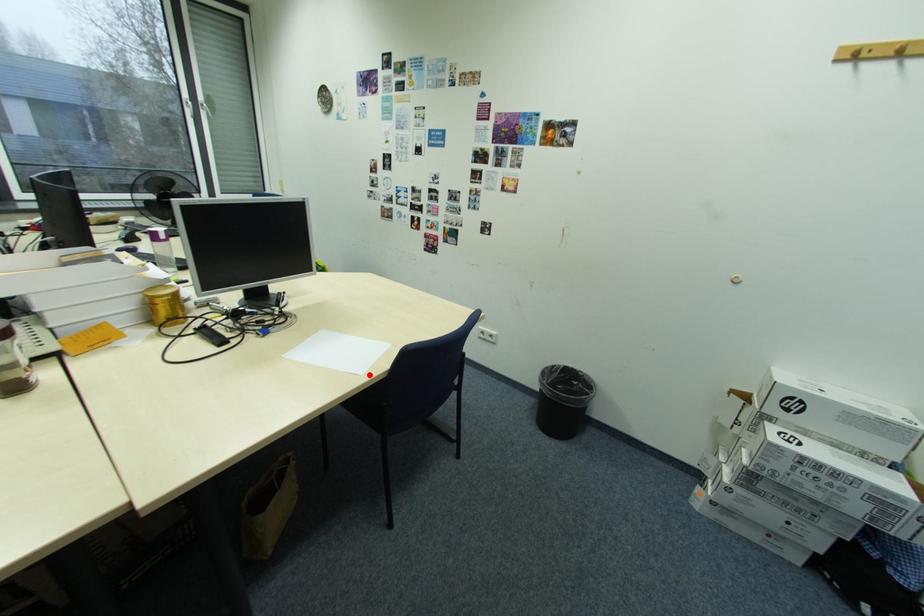
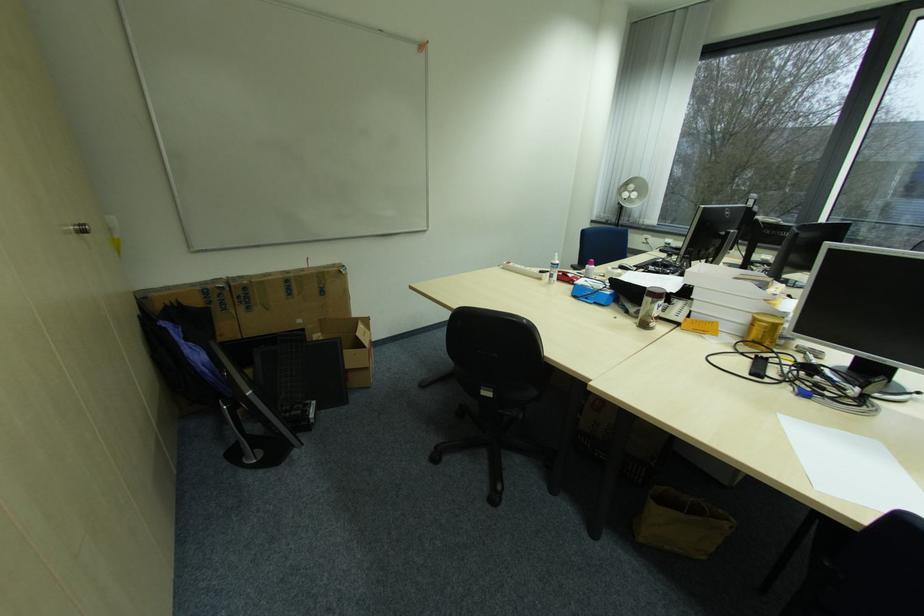
Question: I am providing you with two images of the same scene from different viewpoints. A red point is marked on the first image. Can you still see the location of the red point in image 2?

Choices:
 (A) Yes
 (B) No

Answer: (A)